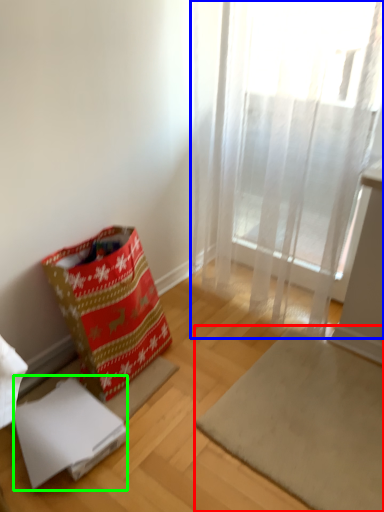
Question: Which object is the closest to the mat (highlighted by a red box)? Choose among these: curtain (highlighted by a blue box) or cardboard box (highlighted by a green box).

Choices:
 (A) curtain
 (B) cardboard box

Answer: (B)